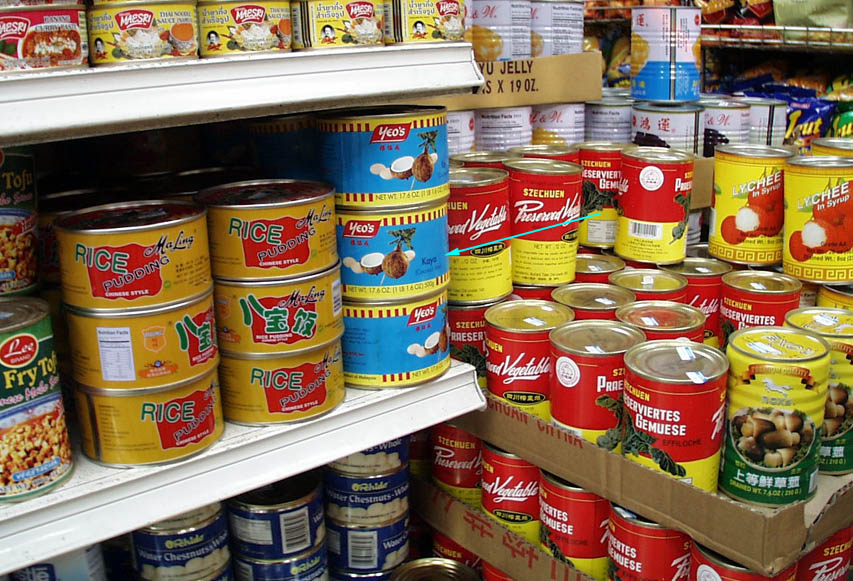
This screenshot has width=853, height=581. I want to click on rack, so click(x=821, y=45).